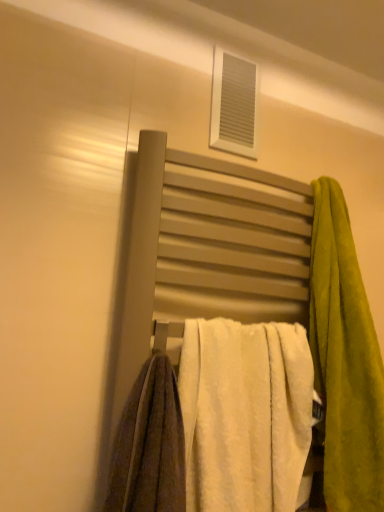
Question: From a real-world perspective, is white plastic vent at upper center physically located above or below green plush towel at right, the first towel from the right?

Choices:
 (A) below
 (B) above

Answer: (B)

Question: Considering the relative positions of white plastic vent at upper center and green plush towel at right, which is the 2th towel in left-to-right order, in the image provided, is white plastic vent at upper center to the left or to the right of green plush towel at right, which is the 2th towel in left-to-right order,?

Choices:
 (A) right
 (B) left

Answer: (B)

Question: Considering the real-world distances, which object is closest to the white fluffy towel at center, the second towel viewed from the right?

Choices:
 (A) green plush towel at right, which is the 2th towel in left-to-right order
 (B) white plastic vent at upper center
 (C) matte gray towel rack at center

Answer: (C)

Question: Which object is the closest to the green plush towel at right, the first towel from the right?

Choices:
 (A) white fluffy towel at center, the 1th towel when ordered from left to right
 (B) white plastic vent at upper center
 (C) matte gray towel rack at center

Answer: (C)